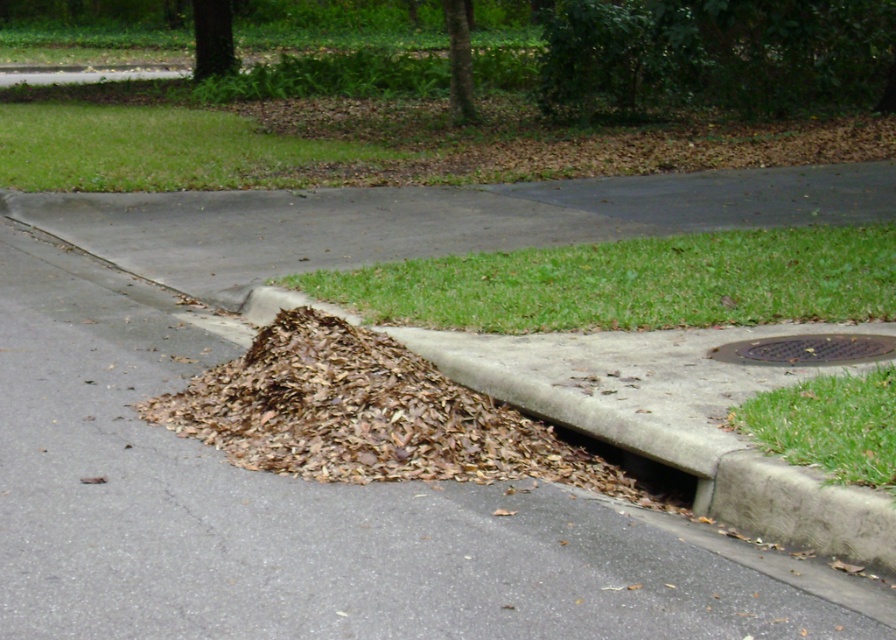
Who is positioned more to the left, green grass at upper center or green grass at lower right?

From the viewer's perspective, green grass at upper center appears more on the left side.

Which of these two, green grass at upper center or green grass at lower right, stands shorter?

green grass at lower right is shorter.

I want to click on green grass at upper center, so coord(367,141).

Where is `green grass at upper center`? The image size is (896, 640). green grass at upper center is located at coordinates (367, 141).

Who is positioned more to the left, green grass at upper center or brown dried leaves at center?

From the viewer's perspective, green grass at upper center appears more on the left side.

Can you confirm if green grass at upper center is positioned to the right of brown dried leaves at center?

No, green grass at upper center is not to the right of brown dried leaves at center.

What do you see at coordinates (367, 141) in the screenshot?
I see `green grass at upper center` at bounding box center [367, 141].

Where is `green grass at upper center`? The height and width of the screenshot is (640, 896). green grass at upper center is located at coordinates (367, 141).

Who is shorter, green grass at center or brown concrete hole at lower right?

brown concrete hole at lower right is shorter.

Which is behind, point (630, 310) or point (588, 442)?

The point (630, 310) is behind.

Between point (378, 323) and point (655, 480), which one is positioned in front?

Point (655, 480) is more forward.

Locate an element on the screen. This screenshot has height=640, width=896. green grass at center is located at coordinates (631, 282).